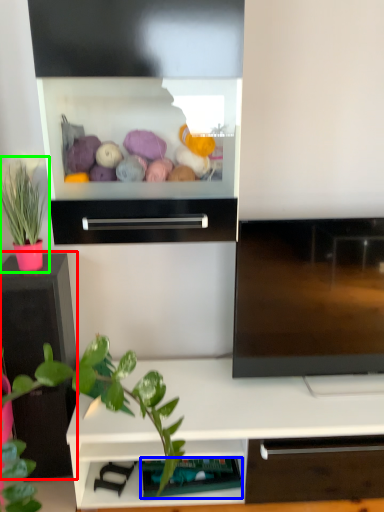
Question: Considering the real-world distances, which object is closest to tv cabinet (highlighted by a red box)? shelf (highlighted by a blue box) or houseplant (highlighted by a green box).

Choices:
 (A) shelf
 (B) houseplant

Answer: (B)